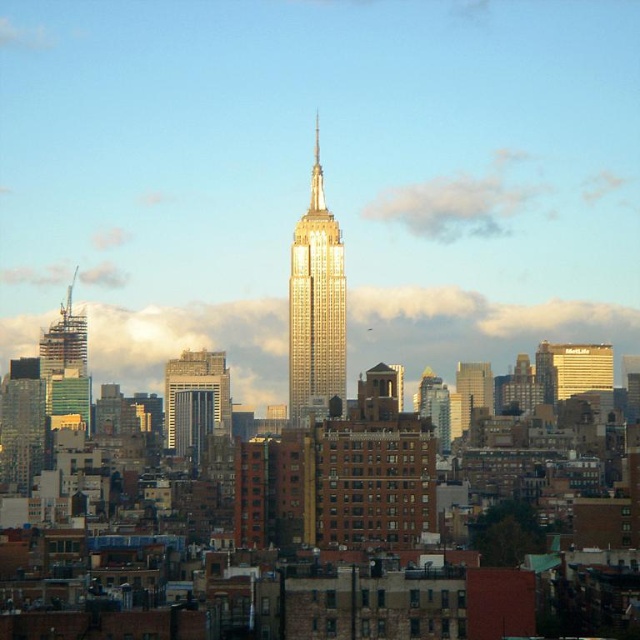
Between point (406, 189) and point (554, 346), which one is positioned in front?

Positioned in front is point (406, 189).

Which is behind, point (404, 214) or point (566, 365)?

The point (566, 365) is behind.

Image resolution: width=640 pixels, height=640 pixels. I want to click on white fluffy cloud at upper center, so click(x=456, y=202).

Between white fluffy cloud at upper center and gray concrete skyscraper at center, which one has more height?

With more height is gray concrete skyscraper at center.

Does white fluffy cloud at upper center come in front of gray concrete skyscraper at center?

No.

Locate an element on the screen. Image resolution: width=640 pixels, height=640 pixels. white fluffy cloud at upper center is located at coordinates (456, 202).

Does cloudy sky at center lie in front of green glass building at left?

Yes, cloudy sky at center is in front of green glass building at left.

Is cloudy sky at center below green glass building at left?

No, cloudy sky at center is not below green glass building at left.

This screenshot has width=640, height=640. I want to click on cloudy sky at center, so pos(472,326).